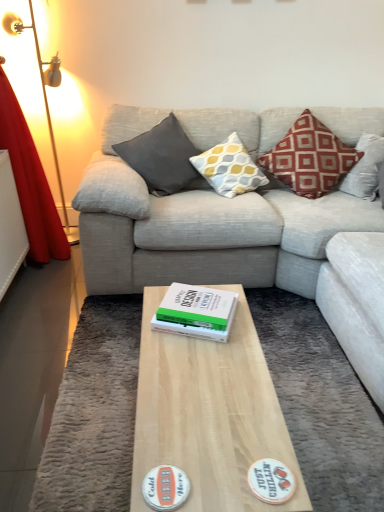
At what (x,y) coordinates should I click in order to perform the action: click on free space to the left of white matte sticker at center, the second sticker in the left-to-right sequence. Please return your answer as a coordinate pair (x, y). This screenshot has width=384, height=512. Looking at the image, I should click on (213, 461).